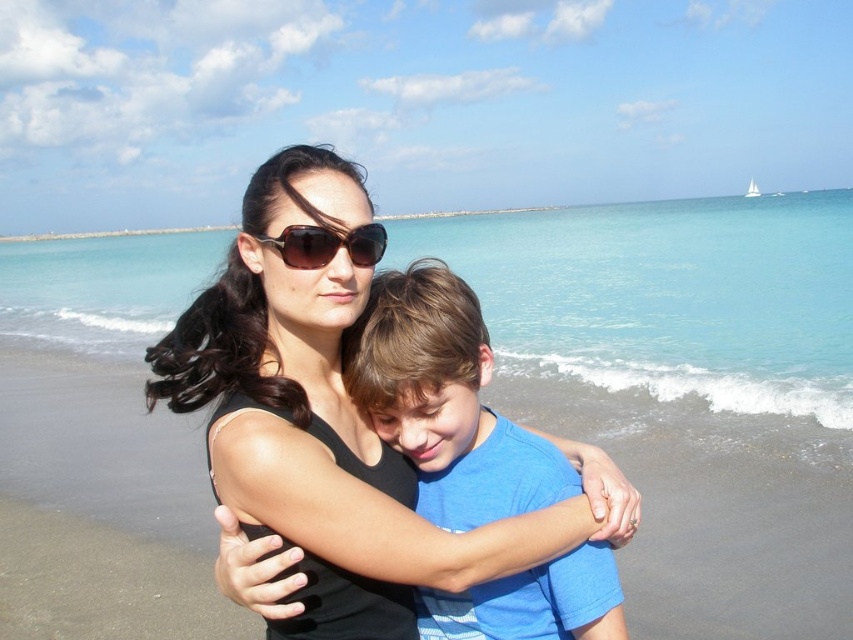
Question: Does blue cotton shirt at center have a smaller size compared to brown reflective sunglasses at center?

Choices:
 (A) yes
 (B) no

Answer: (B)

Question: Can you confirm if blue cotton shirt at center is thinner than brown reflective sunglasses at center?

Choices:
 (A) no
 (B) yes

Answer: (A)

Question: Which object appears farthest from the camera in this image?

Choices:
 (A) brown reflective sunglasses at center
 (B) blue cotton shirt at center

Answer: (B)

Question: Considering the relative positions of blue cotton shirt at center and brown reflective sunglasses at center in the image provided, where is blue cotton shirt at center located with respect to brown reflective sunglasses at center?

Choices:
 (A) below
 (B) above

Answer: (A)